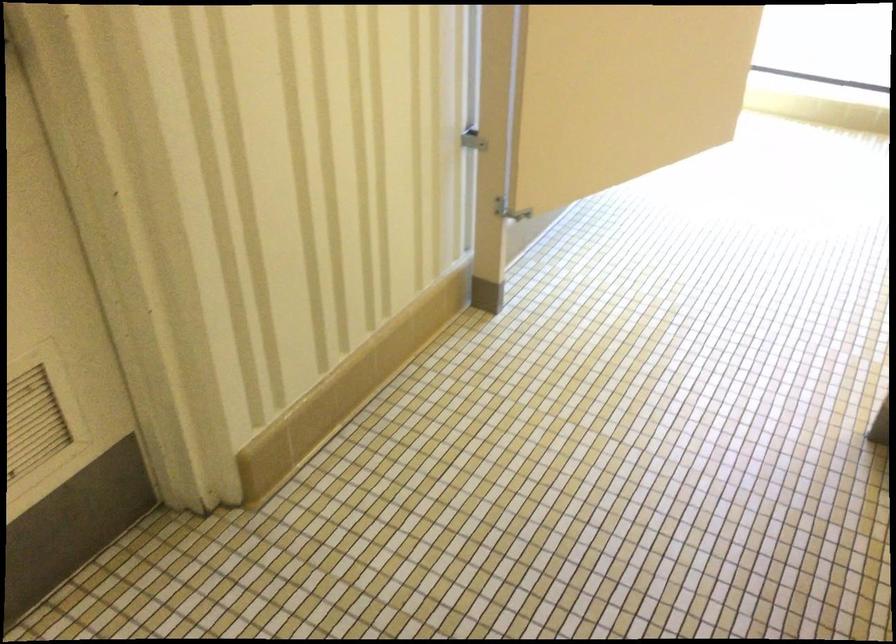
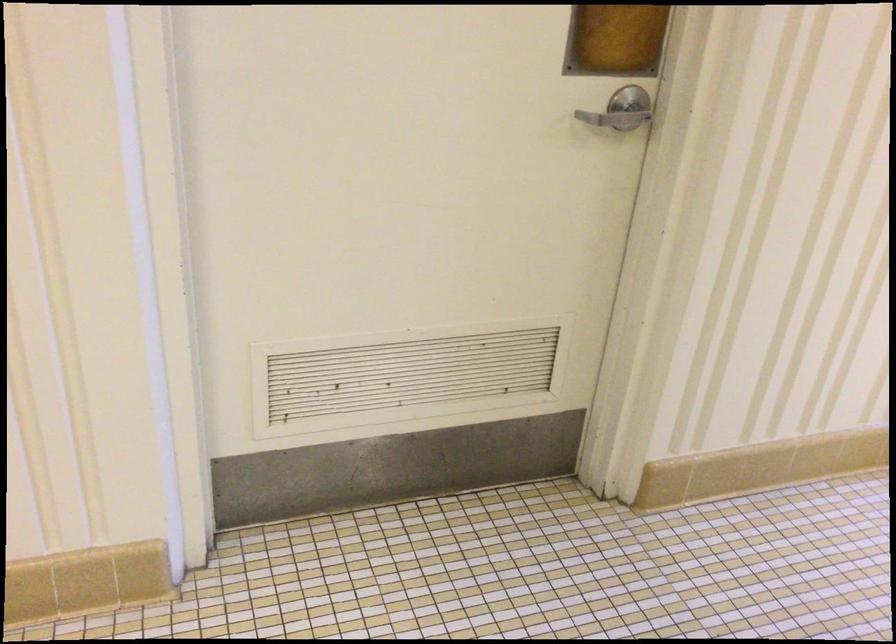
Question: How did the camera likely rotate?

Choices:
 (A) Left
 (B) Right
 (C) Up
 (D) Down

Answer: (A)